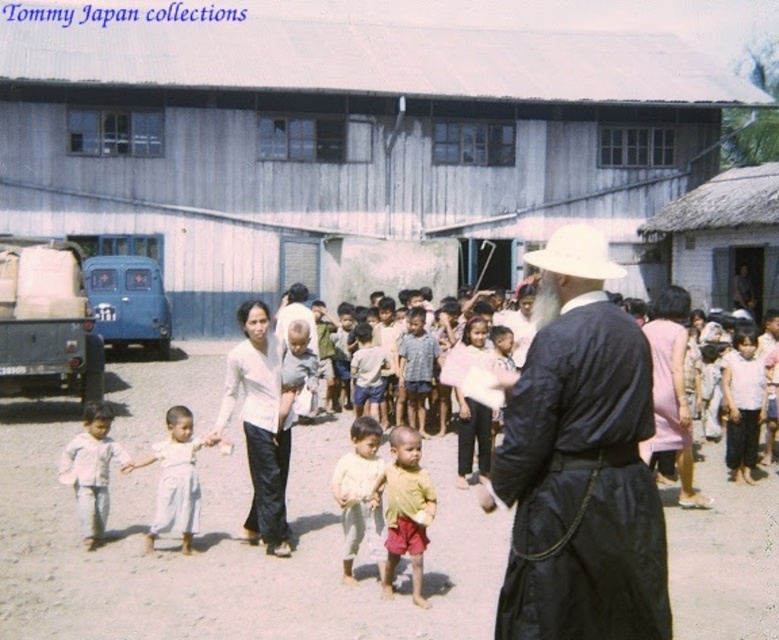
Question: Among these objects, which one is nearest to the camera?

Choices:
 (A) thatched straw hut at right
 (B) brown dirt field at center
 (C) light pink fabric at lower left
 (D) light brown cotton pants at center

Answer: (B)

Question: Is thatched straw hut at right positioned before white matte cowboy hat at center?

Choices:
 (A) yes
 (B) no

Answer: (B)

Question: Observing the image, what is the correct spatial positioning of thatched straw hut at right in reference to light pink fabric at lower left?

Choices:
 (A) above
 (B) below

Answer: (A)

Question: Among these objects, which one is nearest to the camera?

Choices:
 (A) thatched roof hut at center
 (B) brown dirt field at center

Answer: (B)

Question: Which point is closer to the camera taking this photo?

Choices:
 (A) (249, 346)
 (B) (700, 285)
 (C) (608, 276)
 (D) (189, 234)

Answer: (C)

Question: Is black matte robe at center thinner than thatched straw hut at right?

Choices:
 (A) no
 (B) yes

Answer: (A)